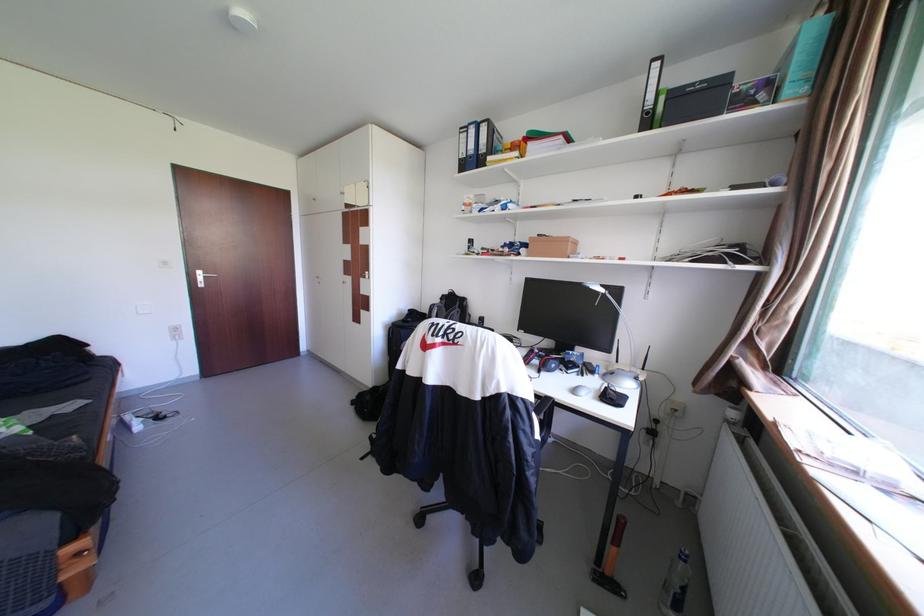
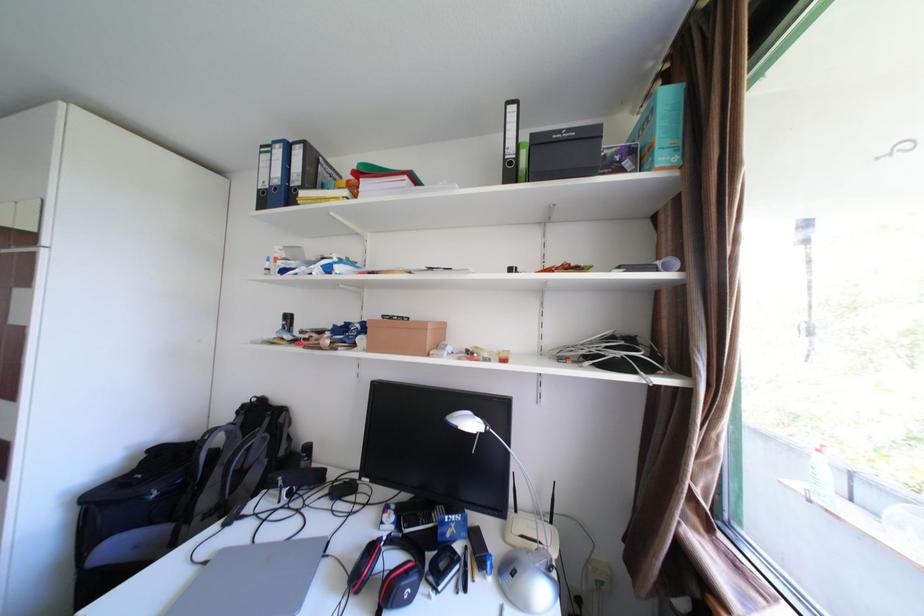
Question: The first image is from the beginning of the video and the second image is from the end. How did the camera likely rotate when shooting the video?

Choices:
 (A) Left
 (B) Right
 (C) Up
 (D) Down

Answer: (B)